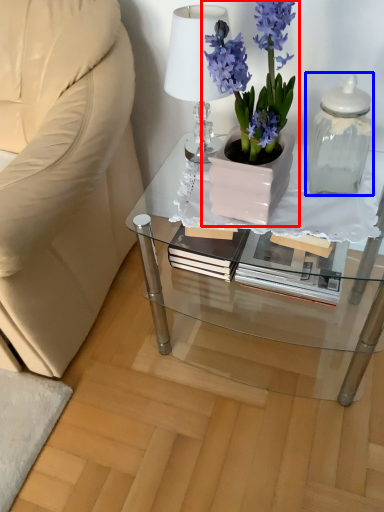
Question: Which point is closer to the camera, houseplant (highlighted by a red box) or bottle (highlighted by a blue box)?

Choices:
 (A) houseplant
 (B) bottle

Answer: (A)